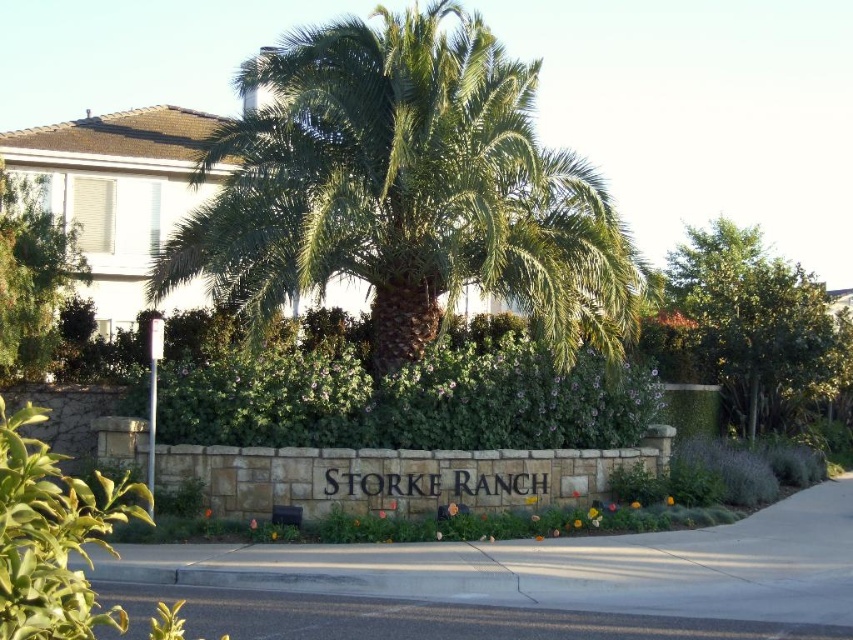
Is green leafy palm tree at center shorter than green leafy tree at left?

In fact, green leafy palm tree at center may be taller than green leafy tree at left.

Which is behind, point (486, 88) or point (32, 364)?

Positioned behind is point (486, 88).

This screenshot has height=640, width=853. I want to click on green leafy palm tree at center, so click(x=405, y=189).

This screenshot has height=640, width=853. In order to click on green leafy palm tree at center in this screenshot , I will do `click(405, 189)`.

Is green leafy tree at right further to camera compared to green leafy tree at left?

Yes, green leafy tree at right is behind green leafy tree at left.

Does green leafy tree at right appear over green leafy tree at left?

Correct, green leafy tree at right is located above green leafy tree at left.

Which is behind, point (692, 333) or point (13, 285)?

Point (692, 333)

Find the location of a particular element. green leafy tree at right is located at coordinates (757, 326).

Is green leafy bush at center wider than green leafy tree at left?

Incorrect, green leafy bush at center's width does not surpass green leafy tree at left's.

Which is in front, point (444, 410) or point (64, 259)?

Point (444, 410) is in front.

I want to click on green leafy bush at center, so pyautogui.click(x=408, y=400).